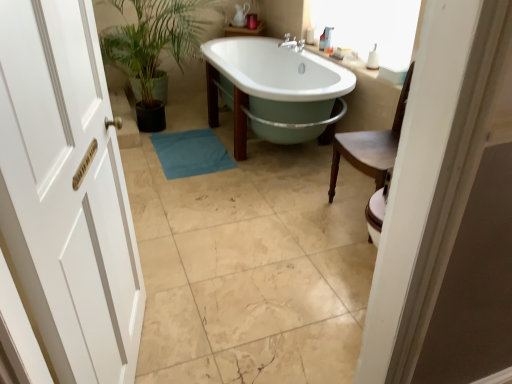
Question: Could you tell me if pastel green enamel bathtub at center is turned towards white glossy sink at upper right?

Choices:
 (A) no
 (B) yes

Answer: (A)

Question: Does pastel green enamel bathtub at center appear on the right side of white glossy sink at upper right?

Choices:
 (A) no
 (B) yes

Answer: (A)

Question: Is pastel green enamel bathtub at center located outside white glossy sink at upper right?

Choices:
 (A) yes
 (B) no

Answer: (A)

Question: Does pastel green enamel bathtub at center contain white glossy sink at upper right?

Choices:
 (A) yes
 (B) no

Answer: (B)

Question: Is the depth of pastel green enamel bathtub at center less than that of white glossy sink at upper right?

Choices:
 (A) no
 (B) yes

Answer: (B)

Question: Considering the relative sizes of pastel green enamel bathtub at center and white glossy sink at upper right in the image provided, is pastel green enamel bathtub at center thinner than white glossy sink at upper right?

Choices:
 (A) yes
 (B) no

Answer: (B)

Question: Is pastel green enamel bathtub at center taller than white wooden door at left?

Choices:
 (A) no
 (B) yes

Answer: (A)

Question: From a real-world perspective, does pastel green enamel bathtub at center stand above white wooden door at left?

Choices:
 (A) no
 (B) yes

Answer: (A)

Question: Is pastel green enamel bathtub at center positioned far away from white wooden door at left?

Choices:
 (A) yes
 (B) no

Answer: (A)

Question: Does pastel green enamel bathtub at center have a smaller size compared to white wooden door at left?

Choices:
 (A) yes
 (B) no

Answer: (B)

Question: From a real-world perspective, is pastel green enamel bathtub at center physically below white wooden door at left?

Choices:
 (A) yes
 (B) no

Answer: (A)

Question: Is pastel green enamel bathtub at center completely or partially outside of white wooden door at left?

Choices:
 (A) no
 (B) yes

Answer: (B)

Question: Considering the relative sizes of white wooden door at left and white glossy sink at upper right in the image provided, is white wooden door at left shorter than white glossy sink at upper right?

Choices:
 (A) yes
 (B) no

Answer: (B)